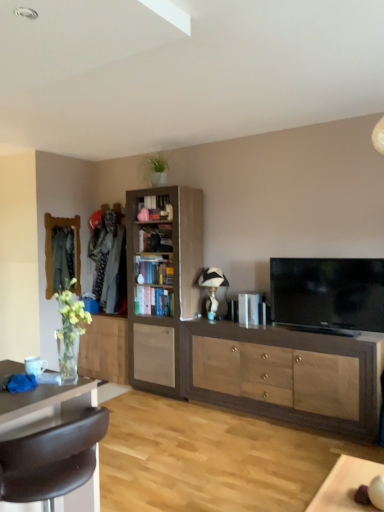
Question: Would you say brown leather chair at lower left is outside flat screen tv at right?

Choices:
 (A) yes
 (B) no

Answer: (A)

Question: Does brown leather chair at lower left have a lesser width compared to flat screen tv at right?

Choices:
 (A) yes
 (B) no

Answer: (B)

Question: Is flat screen tv at right inside brown leather chair at lower left?

Choices:
 (A) no
 (B) yes

Answer: (A)

Question: Is brown leather chair at lower left in contact with flat screen tv at right?

Choices:
 (A) yes
 (B) no

Answer: (B)

Question: From a real-world perspective, is brown leather chair at lower left located beneath flat screen tv at right?

Choices:
 (A) yes
 (B) no

Answer: (A)

Question: Does point (158, 294) appear closer or farther from the camera than point (173, 270)?

Choices:
 (A) farther
 (B) closer

Answer: (A)

Question: From a real-world perspective, relative to light brown wood bookshelf at center, placed as the 2th cabinetry when sorted from right to left, is wooden bookshelf at center, which is the 1th shelf from bottom to top, vertically above or below?

Choices:
 (A) above
 (B) below

Answer: (B)

Question: Relative to light brown wood bookshelf at center, placed as the 2th cabinetry when sorted from right to left, is wooden bookshelf at center, which is the 1th shelf from bottom to top, in front or behind?

Choices:
 (A) front
 (B) behind

Answer: (B)

Question: From the image's perspective, is wooden bookshelf at center, which is the 1th shelf from bottom to top, positioned above or below light brown wood bookshelf at center, acting as the second cabinetry starting from the left?

Choices:
 (A) below
 (B) above

Answer: (A)

Question: Is light brown wood cabinet at center, marked as the third cabinetry in a right-to-left arrangement, in front of or behind brown leather chair at lower left in the image?

Choices:
 (A) behind
 (B) front

Answer: (A)

Question: From the image's perspective, is light brown wood cabinet at center, which is the first cabinetry in left-to-right order, above or below brown leather chair at lower left?

Choices:
 (A) below
 (B) above

Answer: (B)

Question: Considering the positions of light brown wood cabinet at center, which is the first cabinetry in left-to-right order, and brown leather chair at lower left in the image, is light brown wood cabinet at center, which is the first cabinetry in left-to-right order, wider or thinner than brown leather chair at lower left?

Choices:
 (A) thin
 (B) wide

Answer: (A)

Question: In terms of size, does light brown wood cabinet at center, which is the first cabinetry in left-to-right order, appear bigger or smaller than brown leather chair at lower left?

Choices:
 (A) big
 (B) small

Answer: (B)

Question: Considering the positions of matte wood cabinet at center, positioned as the 1th cabinetry in right-to-left order, and brown leather chair at lower left in the image, is matte wood cabinet at center, positioned as the 1th cabinetry in right-to-left order, bigger or smaller than brown leather chair at lower left?

Choices:
 (A) small
 (B) big

Answer: (B)

Question: Based on their positions, is matte wood cabinet at center, which appears as the 3th cabinetry when viewed from the left, located to the left or right of brown leather chair at lower left?

Choices:
 (A) right
 (B) left

Answer: (A)